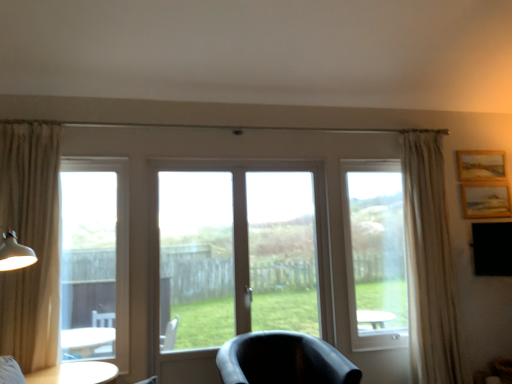
Where is `matte white table lamp at left`? This screenshot has width=512, height=384. matte white table lamp at left is located at coordinates (17, 324).

Based on the photo, measure the distance between matte white table lamp at left and camera.

matte white table lamp at left and camera are 8.64 feet apart.

Describe the element at coordinates (485, 200) in the screenshot. This screenshot has width=512, height=384. I see `wooden textured picture frame at upper right, the first picture frame ordered from the bottom` at that location.

The height and width of the screenshot is (384, 512). Identify the location of clear glass window at left. (98, 243).

This screenshot has width=512, height=384. Describe the element at coordinates (481, 165) in the screenshot. I see `wooden framed picture at upper right, acting as the first picture frame starting from the top` at that location.

You are a GUI agent. You are given a task and a screenshot of the screen. Output one action in this format:
    pyautogui.click(x=<x>, y=<y>)
    Task: Click on the wooden framed picture at upper right, marked as the 2th picture frame in a bottom-to-top arrangement
    The image size is (512, 384).
    Given the screenshot: What is the action you would take?
    pyautogui.click(x=481, y=165)

The width and height of the screenshot is (512, 384). Describe the element at coordinates (283, 360) in the screenshot. I see `matte black chair at center` at that location.

The width and height of the screenshot is (512, 384). In order to click on matte white table lamp at left in this screenshot , I will do `click(17, 324)`.

Relative to wooden framed picture at upper right, marked as the 2th picture frame in a bottom-to-top arrangement, is clear glass window at left in front or behind?

clear glass window at left is in front of wooden framed picture at upper right, marked as the 2th picture frame in a bottom-to-top arrangement.

Does clear glass window at left contain wooden framed picture at upper right, marked as the 2th picture frame in a bottom-to-top arrangement?

That's incorrect, wooden framed picture at upper right, marked as the 2th picture frame in a bottom-to-top arrangement, is not inside clear glass window at left.

Would you say clear glass window at left is a long distance from wooden framed picture at upper right, marked as the 2th picture frame in a bottom-to-top arrangement?

Yes, clear glass window at left and wooden framed picture at upper right, marked as the 2th picture frame in a bottom-to-top arrangement, are quite far apart.

Considering the sizes of clear glass window at left and wooden framed picture at upper right, marked as the 2th picture frame in a bottom-to-top arrangement, in the image, is clear glass window at left taller or shorter than wooden framed picture at upper right, marked as the 2th picture frame in a bottom-to-top arrangement,?

Clearly, clear glass window at left is taller compared to wooden framed picture at upper right, marked as the 2th picture frame in a bottom-to-top arrangement.

From the image's perspective, between white sheer curtain at right, the first curtain when ordered from back to front, and clear glass window at left, which one is located above?

white sheer curtain at right, the first curtain when ordered from back to front.

From a real-world perspective, is white sheer curtain at right, which appears as the 2th curtain when viewed from the left, physically located above or below clear glass window at left?

In terms of real-world spatial position, white sheer curtain at right, which appears as the 2th curtain when viewed from the left, is below clear glass window at left.

Is matte black chair at center facing towards matte white table lamp at left?

No.

From a real-world perspective, is matte black chair at center physically below matte white table lamp at left?

Yes, from a real-world perspective, matte black chair at center is beneath matte white table lamp at left.

Is matte black chair at center far away from matte white table lamp at left?

Indeed, matte black chair at center is not near matte white table lamp at left.

Is matte black chair at center closer to camera compared to matte white table lamp at left?

No, the depth of matte black chair at center is greater than that of matte white table lamp at left.

I want to click on screen door that appears above the matte white table lamp at left (from a real-world perspective), so [x=233, y=258].

From a real-world perspective, which object rests below the other?

matte white table lamp at left.

Can you confirm if transparent glass screen door at center is taller than matte white table lamp at left?

Yes, transparent glass screen door at center is taller than matte white table lamp at left.

Measure the distance from transparent glass screen door at center to matte white table lamp at left.

They are 4.35 feet apart.

Would you say white glossy table at lower left is outside white sheer curtain at right, the second curtain from the front?

Yes, white glossy table at lower left is not within white sheer curtain at right, the second curtain from the front.

In the scene shown: Who is bigger, white glossy table at lower left or white sheer curtain at right, the first curtain when ordered from back to front?

white sheer curtain at right, the first curtain when ordered from back to front.

Is point (113, 377) more distant than point (421, 265)?

That is False.

Is beige fabric curtain at left, the second curtain when ordered from right to left, placed right next to transparent glass window at right?

No, beige fabric curtain at left, the second curtain when ordered from right to left, is not beside transparent glass window at right.

Is point (18, 137) behind point (367, 225)?

No.

Is beige fabric curtain at left, the first curtain in the front-to-back sequence, at the right side of matte black chair at center?

No, beige fabric curtain at left, the first curtain in the front-to-back sequence, is not to the right of matte black chair at center.

From the image's perspective, which is above, beige fabric curtain at left, which ranks as the 2th curtain in back-to-front order, or matte black chair at center?

beige fabric curtain at left, which ranks as the 2th curtain in back-to-front order, is shown above in the image.

Is point (35, 345) closer to viewer compared to point (232, 339)?

Yes, it is.

In the scene shown: Considering the sizes of objects beige fabric curtain at left, the second curtain when ordered from right to left, and matte black chair at center in the image provided, who is smaller, beige fabric curtain at left, the second curtain when ordered from right to left, or matte black chair at center?

beige fabric curtain at left, the second curtain when ordered from right to left, is smaller.

The width and height of the screenshot is (512, 384). I want to click on picture frame that is the 2nd one when counting backward from the clear glass window at left, so click(x=481, y=165).

Locate an element on the screen. The image size is (512, 384). curtain located underneath the clear glass window at left (from a real-world perspective) is located at coordinates (429, 263).

Based on their spatial positions, is clear glass window at left or wooden textured picture frame at upper right, positioned as the second picture frame in top-to-bottom order, closer to wooden framed picture at upper right, acting as the first picture frame starting from the top?

wooden textured picture frame at upper right, positioned as the second picture frame in top-to-bottom order, is positioned closer to the anchor wooden framed picture at upper right, acting as the first picture frame starting from the top.

Looking at this image, based on their spatial positions, is matte black chair at center or white glossy table at lower left closer to white sheer curtain at right, the first curtain when ordered from back to front?

Based on the image, matte black chair at center appears to be nearer to white sheer curtain at right, the first curtain when ordered from back to front.

Based on their spatial positions, is beige fabric curtain at left, the second curtain when ordered from right to left, or matte white table lamp at left closer to matte black chair at center?

beige fabric curtain at left, the second curtain when ordered from right to left, is closer to matte black chair at center.

When comparing their distances from beige fabric curtain at left, which ranks as the 1th curtain in left-to-right order, does clear glass window at left or transparent glass screen door at center seem further?

The object further to beige fabric curtain at left, which ranks as the 1th curtain in left-to-right order, is transparent glass screen door at center.

Looking at the image, which one is located closer to transparent glass window at right, wooden textured picture frame at upper right, positioned as the second picture frame in top-to-bottom order, or matte black chair at center?

Among the two, wooden textured picture frame at upper right, positioned as the second picture frame in top-to-bottom order, is located nearer to transparent glass window at right.

Based on their spatial positions, is wooden textured picture frame at upper right, the first picture frame ordered from the bottom, or white glossy table at lower left closer to transparent glass window at right?

The object closer to transparent glass window at right is wooden textured picture frame at upper right, the first picture frame ordered from the bottom.

From the image, which object appears to be farther from beige fabric curtain at left, which ranks as the 2th curtain in back-to-front order, matte black chair at center or transparent glass window at right?

transparent glass window at right is further to beige fabric curtain at left, which ranks as the 2th curtain in back-to-front order.

Looking at the image, which one is located closer to wooden framed picture at upper right, acting as the first picture frame starting from the top, transparent glass window at right or wooden textured picture frame at upper right, the first picture frame ordered from the bottom?

Based on the image, wooden textured picture frame at upper right, the first picture frame ordered from the bottom, appears to be nearer to wooden framed picture at upper right, acting as the first picture frame starting from the top.

Identify the location of curtain between clear glass window at left and wooden textured picture frame at upper right, the first picture frame ordered from the bottom, from left to right. (429, 263).

I want to click on curtain between beige fabric curtain at left, which ranks as the 1th curtain in left-to-right order, and wooden textured picture frame at upper right, the first picture frame ordered from the bottom, so click(429, 263).

At what (x,y) coordinates should I click in order to perform the action: click on table located between clear glass window at left and wooden textured picture frame at upper right, the first picture frame ordered from the bottom, in the left-right direction. Please return your answer as a coordinate pair (x, y). The image size is (512, 384). Looking at the image, I should click on (75, 373).

Identify the location of chair between beige fabric curtain at left, which ranks as the 2th curtain in back-to-front order, and wooden textured picture frame at upper right, positioned as the second picture frame in top-to-bottom order, in the horizontal direction. (283, 360).